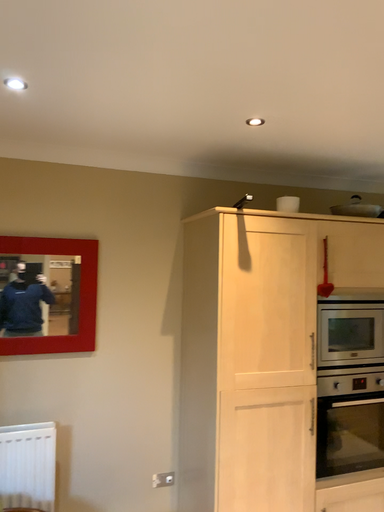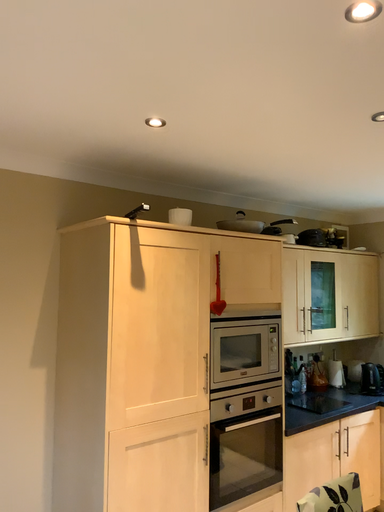
Question: Which way did the camera rotate in the video?

Choices:
 (A) rotated right
 (B) rotated left

Answer: (A)